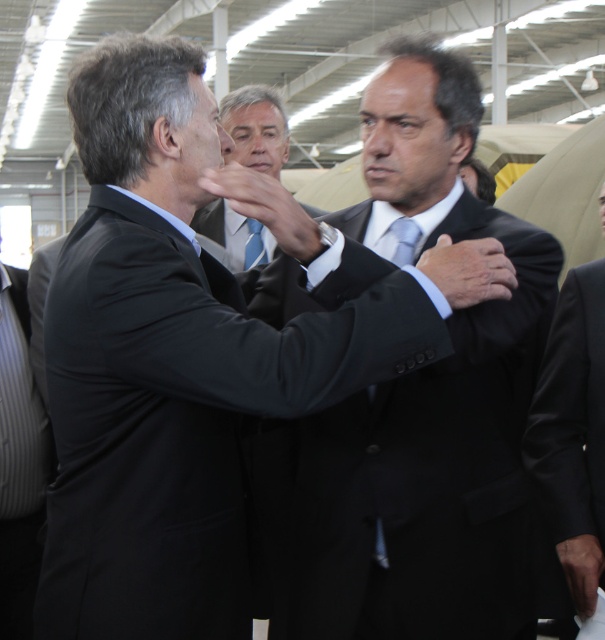
You are a photographer standing at a specific position. You want to take a closeup photo of the matte black suit at center. According to the scene description, what is the minimum distance you need to move forward to ensure the subject fills the frame properly?

The matte black suit at center is 2.84 meters away from the camera. To take a closeup photo, you need to move forward until the distance is reduced to an appropriate range for closeup, typically around 1 meter. Therefore, you should move forward approximately 1.84 meters closer to the matte black suit at center.

You are standing in the conference hall and see two points marked in the image. Which point, point (x=204, y=216) or point (x=399, y=234), is closer to you?

Point (x=204, y=216) is closer to you because it is further to the viewer than point (x=399, y=234).